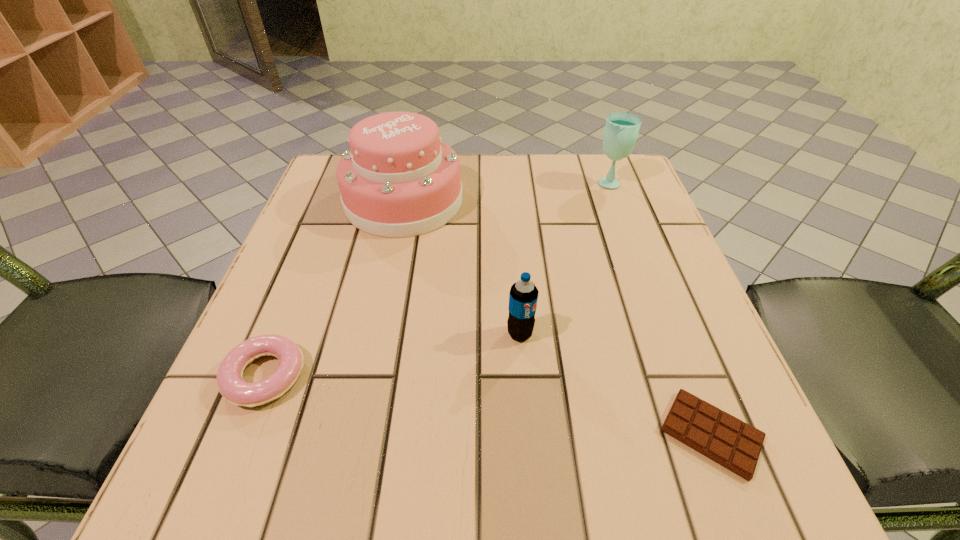
In order to click on unoccupied position between the glass and the candy bar in this screenshot , I will do `click(660, 308)`.

Image resolution: width=960 pixels, height=540 pixels. Find the location of `vacant area between the glass and the shortest object`. vacant area between the glass and the shortest object is located at coordinates (660, 308).

This screenshot has height=540, width=960. Find the location of `free area in between the cake and the fourth tallest object`. free area in between the cake and the fourth tallest object is located at coordinates (334, 288).

Image resolution: width=960 pixels, height=540 pixels. Find the location of `vacant point located between the second shortest object and the candy bar`. vacant point located between the second shortest object and the candy bar is located at coordinates (488, 405).

You are a GUI agent. You are given a task and a screenshot of the screen. Output one action in this format:
    pyautogui.click(x=<x>, y=<y>)
    Task: Click on the vacant point located between the cake and the glass
    Image resolution: width=960 pixels, height=540 pixels.
    Given the screenshot: What is the action you would take?
    pyautogui.click(x=507, y=191)

Find the location of `vacant area between the soda bottle and the glass`. vacant area between the soda bottle and the glass is located at coordinates (564, 258).

At what (x,y) coordinates should I click in order to perform the action: click on vacant area that lies between the cake and the shortest object. Please return your answer as a coordinate pair (x, y). The height and width of the screenshot is (540, 960). Looking at the image, I should click on (558, 318).

Identify which object is the second nearest to the candy bar. Please provide its 2D coordinates. Your answer should be formatted as a tuple, i.e. [(x, y)], where the tuple contains the x and y coordinates of a point satisfying the conditions above.

[(399, 179)]

Where is `object that ranks as the fourth closest to the cake`? The height and width of the screenshot is (540, 960). object that ranks as the fourth closest to the cake is located at coordinates (730, 442).

At what (x,y) coordinates should I click in order to perform the action: click on free spot that satisfies the following two spatial constraints: 1. on the front side of the shortest object; 2. on the left side of the fourth tallest object. Please return your answer as a coordinate pair (x, y). Looking at the image, I should click on (242, 434).